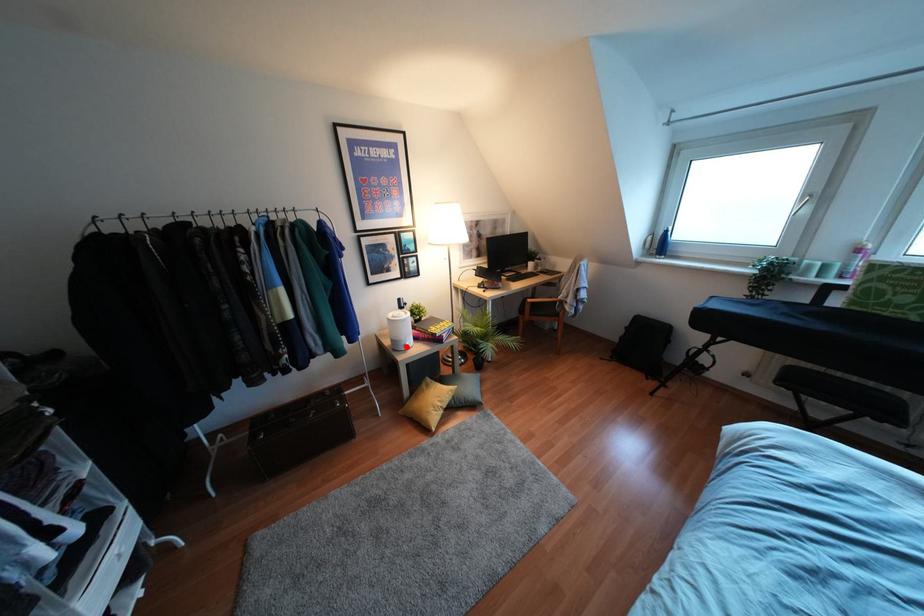
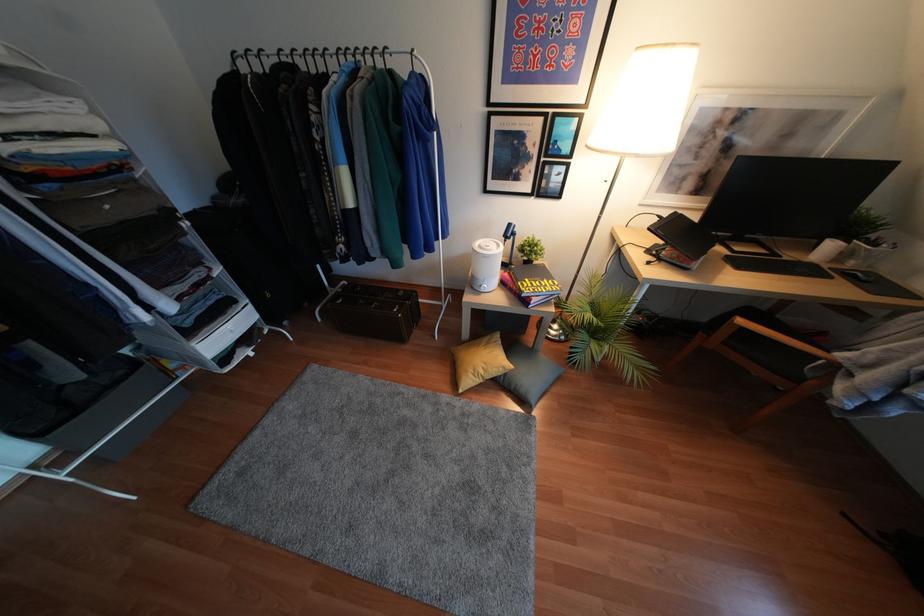
Question: I am providing you with two images of the same scene from different viewpoints. In image1, a red point is highlighted. Considering the same 3D point in image2, which of the following is correct?

Choices:
 (A) It is closer
 (B) It is farther

Answer: (A)